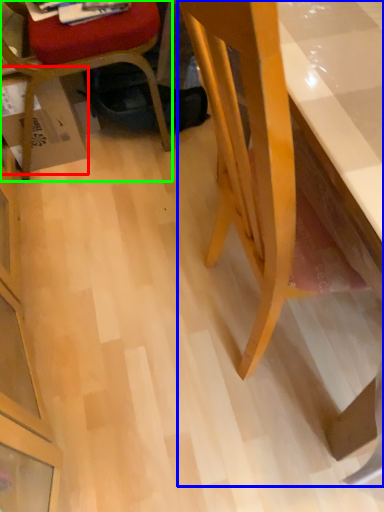
Question: Which object is positioned closest to cardboard box (highlighted by a red box)? Select from desk (highlighted by a blue box) and chair (highlighted by a green box).

Choices:
 (A) desk
 (B) chair

Answer: (B)